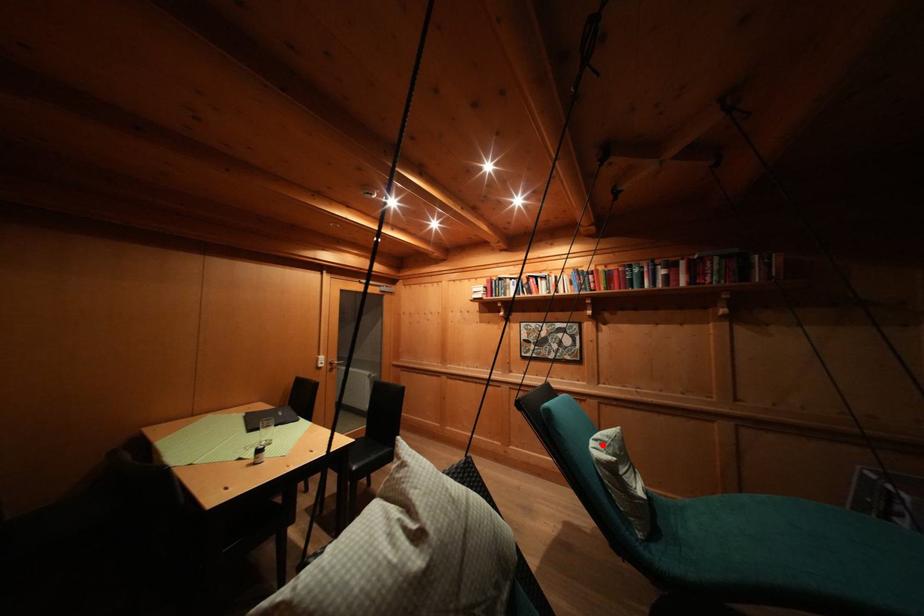
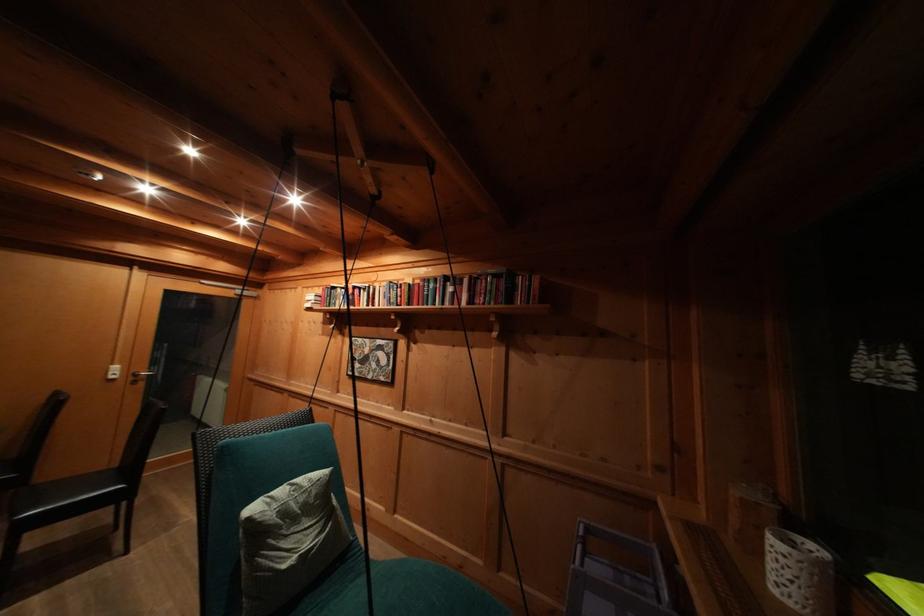
In the second image, find the point that corresponds to the highlighted location in the first image.

(298, 490)